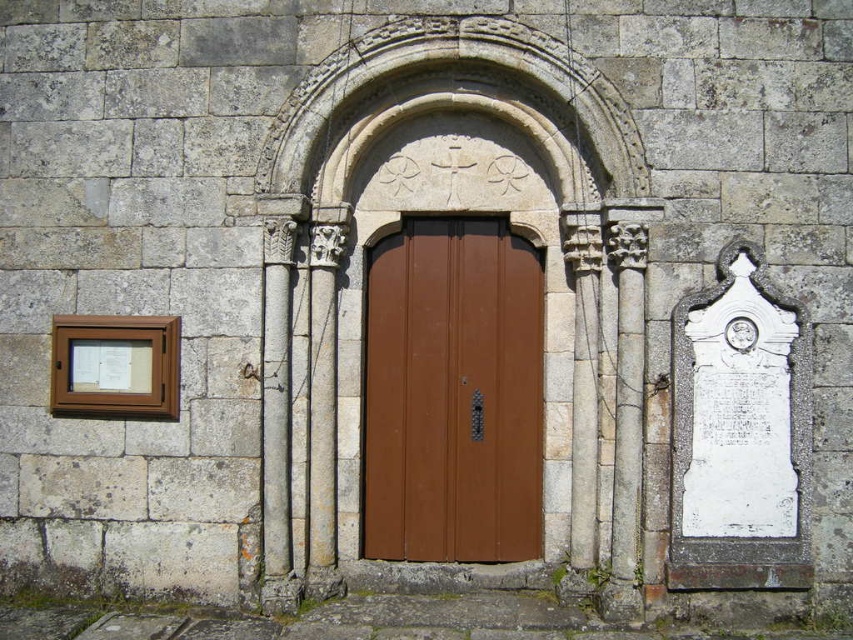
Question: Is brown matte door at center wider than white stone column at center?

Choices:
 (A) yes
 (B) no

Answer: (A)

Question: Which point is closer to the camera?

Choices:
 (A) (454, 232)
 (B) (277, 262)

Answer: (B)

Question: Which point appears closest to the camera in this image?

Choices:
 (A) (424, 305)
 (B) (289, 240)

Answer: (B)

Question: Does brown matte door at center appear under white stone column at center?

Choices:
 (A) no
 (B) yes

Answer: (A)

Question: Can you confirm if brown matte door at center is positioned below white stone column at center?

Choices:
 (A) no
 (B) yes

Answer: (A)